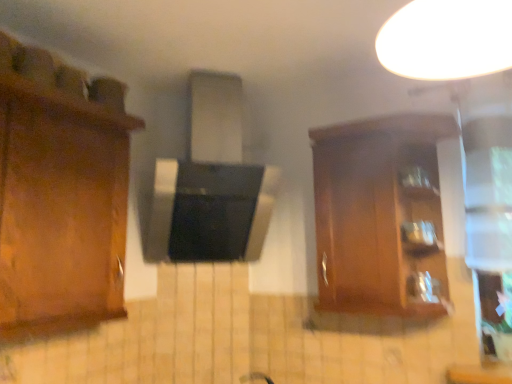
Question: Should I look upward or downward to see wooden cabinet at right?

Choices:
 (A) down
 (B) up

Answer: (A)